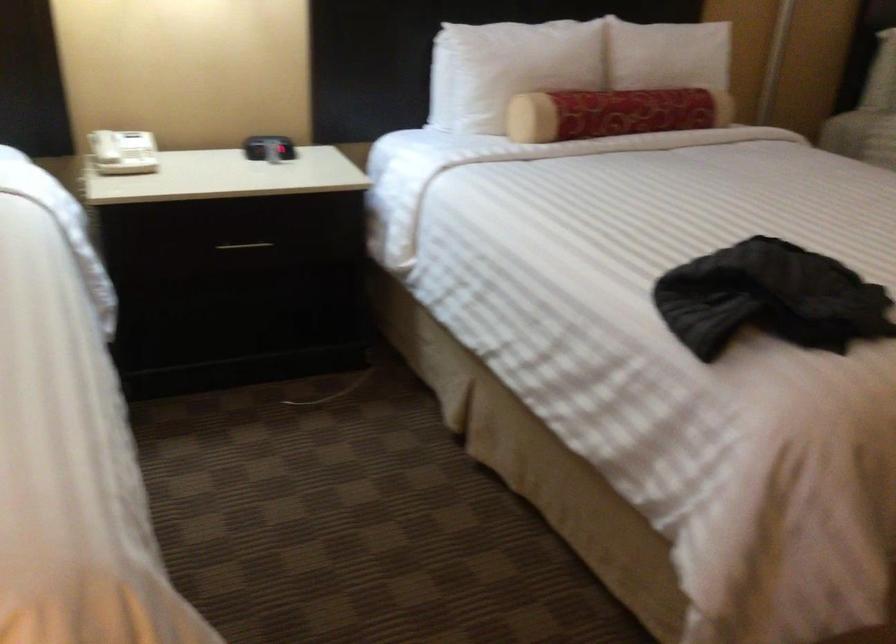
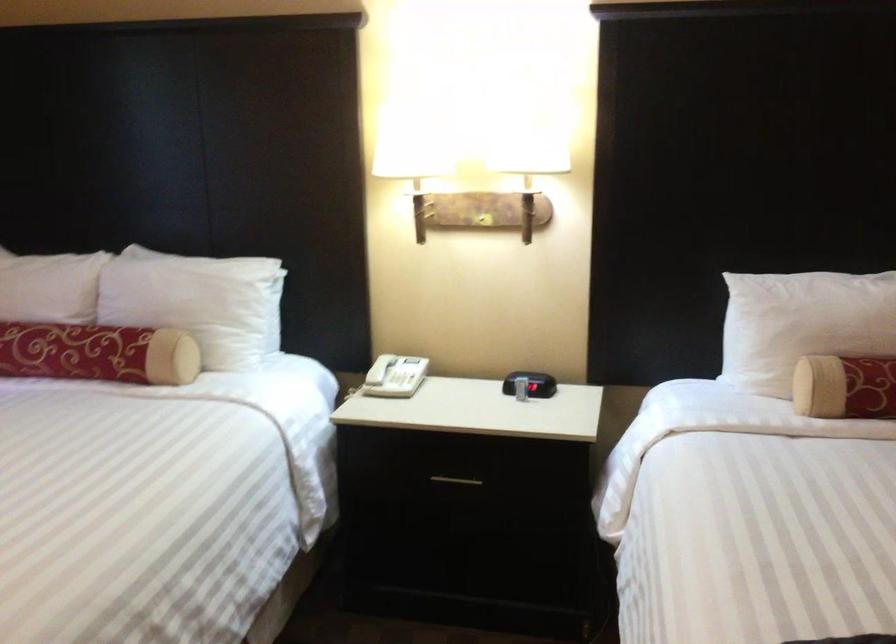
Where in the second image is the point corresponding to point (518, 71) from the first image?

(802, 324)